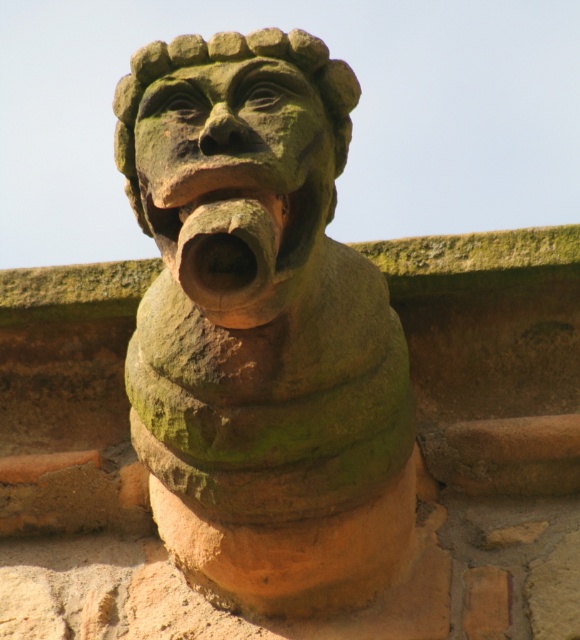
Question: Does green stone gargoyle at center have a smaller size compared to earthy clay mouth at center?

Choices:
 (A) yes
 (B) no

Answer: (B)

Question: Does green stone gargoyle at center have a smaller size compared to earthy clay mouth at center?

Choices:
 (A) no
 (B) yes

Answer: (A)

Question: Does green stone gargoyle at center have a larger size compared to green stone head at center?

Choices:
 (A) no
 (B) yes

Answer: (B)

Question: Among these objects, which one is nearest to the camera?

Choices:
 (A) earthy clay mouth at center
 (B) green stone head at center
 (C) green stone gargoyle at center

Answer: (A)

Question: Which point is farther to the camera?

Choices:
 (A) (379, 493)
 (B) (252, 211)
 (C) (232, 88)

Answer: (A)

Question: Which point is farther to the camera?

Choices:
 (A) (259, 252)
 (B) (387, 364)
 (C) (299, 218)

Answer: (B)